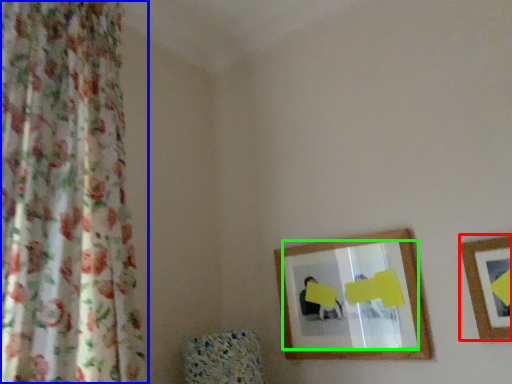
Question: Considering the real-world distances, which object is farthest from picture frame (highlighted by a red box)? curtain (highlighted by a blue box) or mirror (highlighted by a green box)?

Choices:
 (A) curtain
 (B) mirror

Answer: (A)